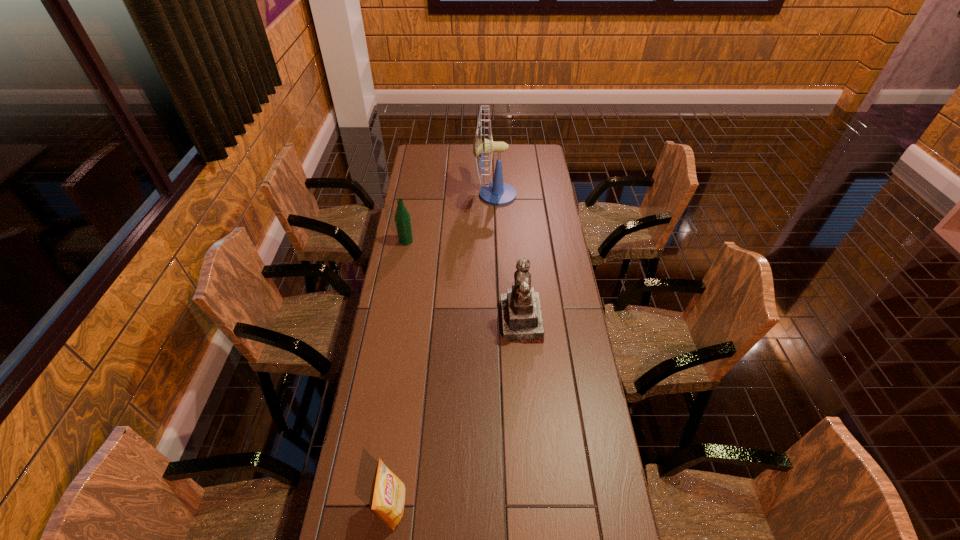
The height and width of the screenshot is (540, 960). I want to click on vacant space at the left edge of the desktop, so click(403, 384).

In the image, there is a desktop. Where is `vacant space at the right edge`? This screenshot has width=960, height=540. vacant space at the right edge is located at coordinates (550, 282).

You are a GUI agent. You are given a task and a screenshot of the screen. Output one action in this format:
    pyautogui.click(x=<x>, y=<y>)
    Task: Click on the vacant space at the far left corner of the desktop
    
    Given the screenshot: What is the action you would take?
    pyautogui.click(x=427, y=145)

At what (x,y) coordinates should I click in order to perform the action: click on vacant space at the far right corner of the desktop. Please return your answer as a coordinate pair (x, y). This screenshot has width=960, height=540. Looking at the image, I should click on (528, 161).

The width and height of the screenshot is (960, 540). In order to click on free spot between the bottle and the fan in this screenshot , I will do `click(450, 218)`.

The height and width of the screenshot is (540, 960). What are the coordinates of `empty space that is in between the second farthest object and the second nearest object` in the screenshot? It's located at (464, 281).

Where is `vacant space that is in between the farthest object and the bottle`? The width and height of the screenshot is (960, 540). vacant space that is in between the farthest object and the bottle is located at coordinates (x=450, y=218).

At what (x,y) coordinates should I click in order to perform the action: click on free spot between the nearest object and the tallest object. Please return your answer as a coordinate pair (x, y). The height and width of the screenshot is (540, 960). Looking at the image, I should click on (444, 350).

At what (x,y) coordinates should I click in order to perform the action: click on vacant area that lies between the third shortest object and the nearest object. Please return your answer as a coordinate pair (x, y). This screenshot has height=540, width=960. Looking at the image, I should click on (457, 413).

Find the location of `free spot between the second object from left to right and the figurine`. free spot between the second object from left to right and the figurine is located at coordinates (457, 413).